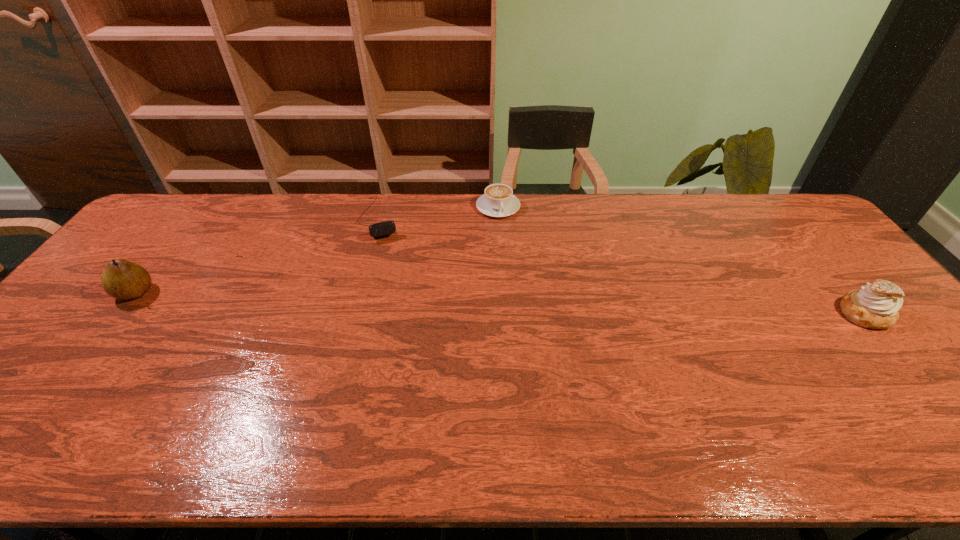
The width and height of the screenshot is (960, 540). I want to click on vacant area at the left edge of the desktop, so click(x=87, y=302).

Identify the location of vacant area at the right edge of the desktop. The image size is (960, 540). (858, 281).

I want to click on vacant space that's between the third object from left to right and the pear, so [317, 250].

Where is `blank region between the second tallest object and the cappuccino`? This screenshot has width=960, height=540. blank region between the second tallest object and the cappuccino is located at coordinates (682, 260).

I want to click on free spot between the webcam and the tallest object, so click(257, 256).

I want to click on free space between the leftmost object and the second object from right to left, so click(x=317, y=250).

This screenshot has width=960, height=540. I want to click on vacant point located between the cappuccino and the rightmost object, so click(682, 260).

Identify the location of vacant point located between the cappuccino and the rightmost object. (682, 260).

The width and height of the screenshot is (960, 540). In order to click on vacant space that's between the third object from right to left and the second object from right to left in this screenshot , I will do `click(439, 213)`.

I want to click on vacant space that is in between the webcam and the second object from right to left, so click(439, 213).